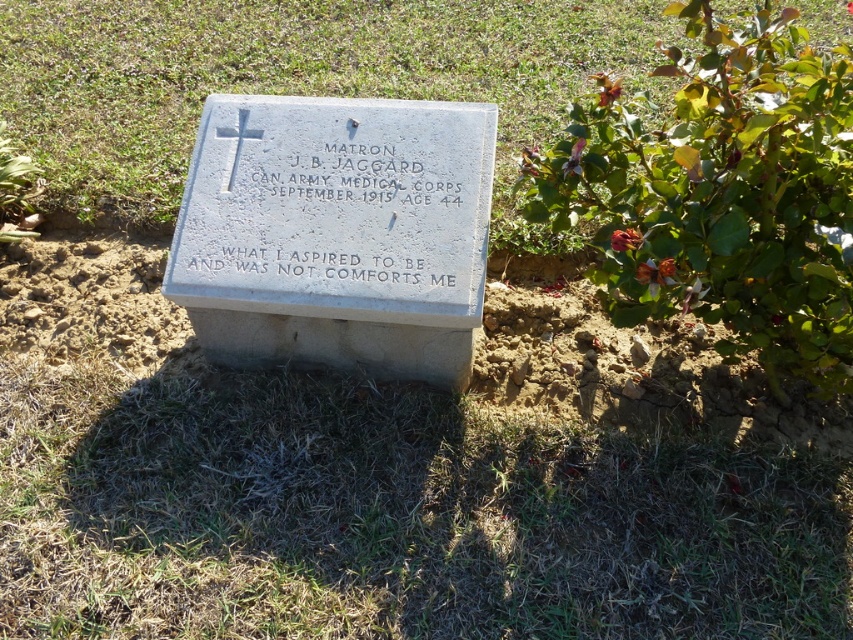
Is green grass at lower center to the left of white stone cross at upper center from the viewer's perspective?

No, green grass at lower center is not to the left of white stone cross at upper center.

Can you confirm if green grass at lower center is wider than white stone cross at upper center?

Yes.

You are a GUI agent. You are given a task and a screenshot of the screen. Output one action in this format:
    pyautogui.click(x=<x>, y=<y>)
    Task: Click on the green grass at lower center
    
    Given the screenshot: What is the action you would take?
    pyautogui.click(x=392, y=516)

Where is `green grass at lower center`? The height and width of the screenshot is (640, 853). green grass at lower center is located at coordinates (392, 516).

Does green grass at center appear over bright red petals at upper right?

Yes, green grass at center is above bright red petals at upper right.

Is point (444, 90) closer to camera compared to point (628, 241)?

No, (444, 90) is behind (628, 241).

At what (x,y) coordinates should I click in order to perform the action: click on green grass at center. Please return your answer as a coordinate pair (x, y). This screenshot has height=640, width=853. Looking at the image, I should click on (296, 81).

Does point (341, 45) come in front of point (659, 273)?

No, (341, 45) is further to viewer.

Which of these two, green grass at center or orange matte flower at right, stands shorter?

orange matte flower at right is shorter.

Does point (163, 152) lie behind point (654, 269)?

Yes, point (163, 152) is farther from viewer.

Identify the location of green grass at center. (296, 81).